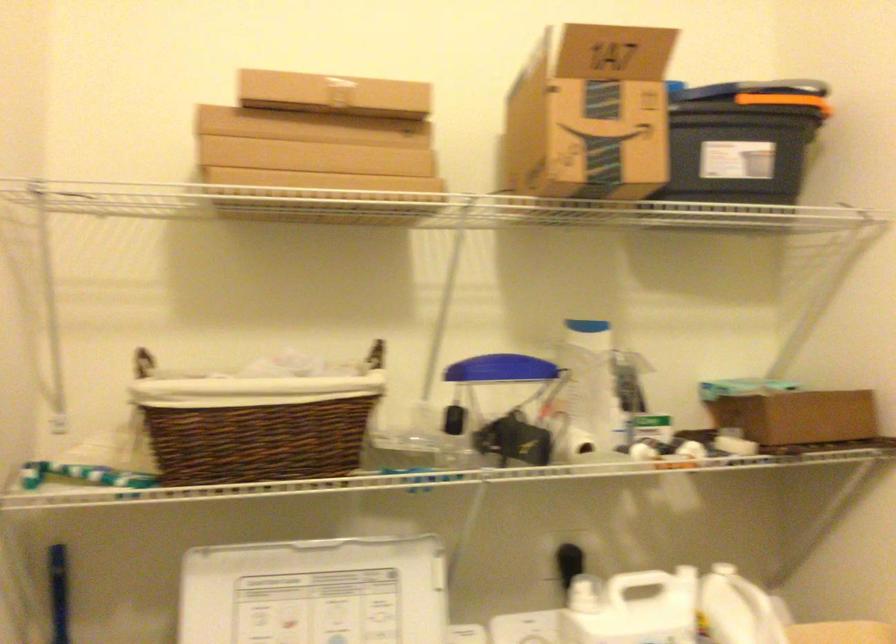
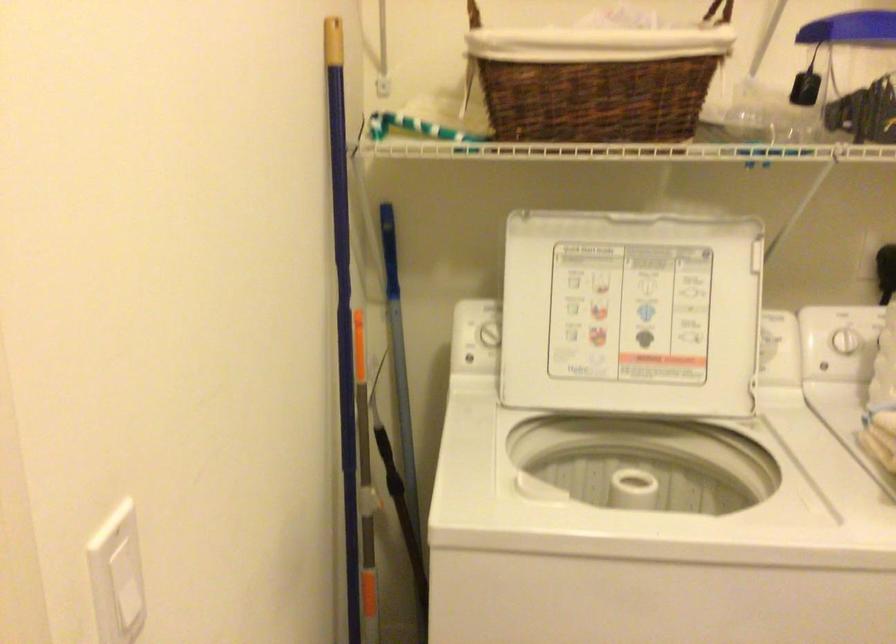
Where in the second image is the point corresponding to point (257, 420) from the first image?

(597, 79)